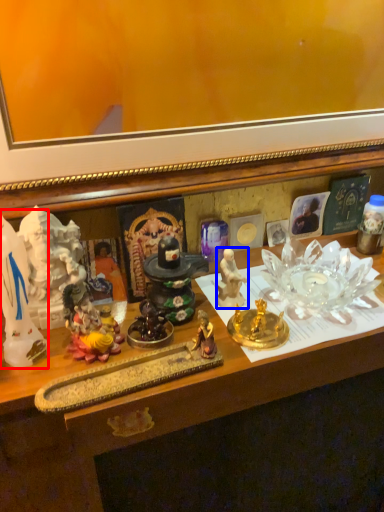
Question: Which object appears farthest to the camera in this image, toy (highlighted by a red box) or person (highlighted by a blue box)?

Choices:
 (A) toy
 (B) person

Answer: (B)